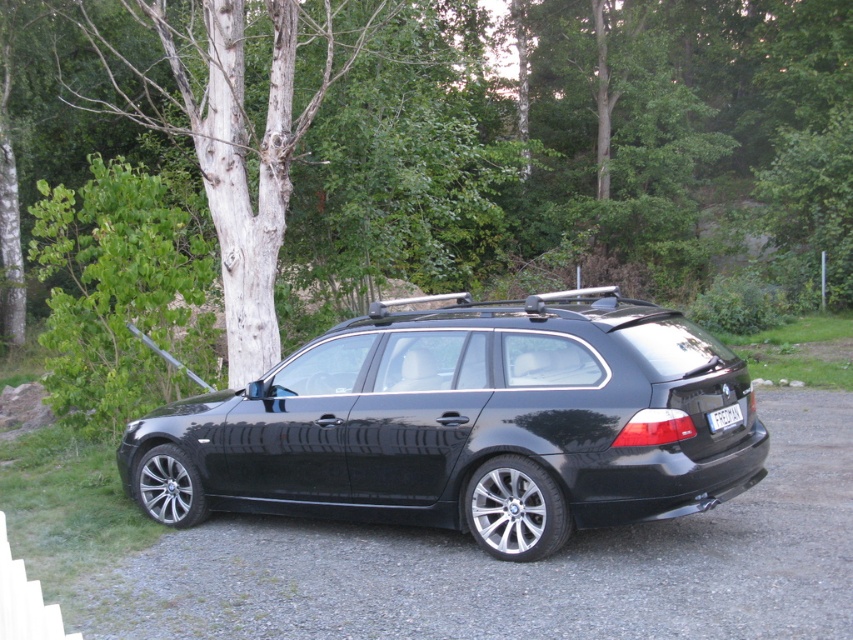
You are a delivery driver who needs to park your 16.5 feet long truck next to the glossy black car at center and the black asphalt at center. Can both vehicles fit side by side without overlapping?

The glossy black car at center is 5.66 feet from black asphalt at center. Since the truck is 16.5 feet long, it would require more space than the available distance between the two vehicles. Therefore, they cannot fit side by side without overlapping.

You are a photographer planning to take a picture of the black BMW estate car. You notice the smooth bark tree at left and the white plastic license plate at rear in the frame. Based on their sizes in the image, which object would you adjust your camera focus on to ensure clarity for the larger subject?

The smooth bark tree at left has a larger size compared to the white plastic license plate at rear, so you should adjust your camera focus on the smooth bark tree at left to ensure clarity for the larger subject.